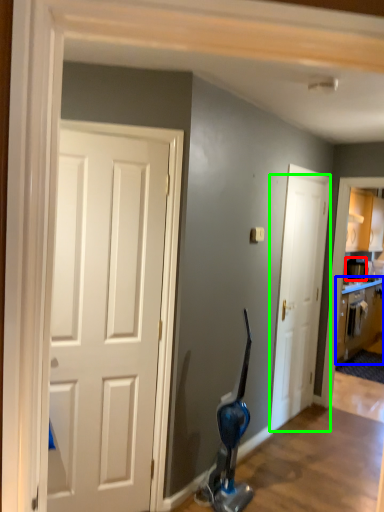
Question: Estimate the real-world distances between objects in this image. Which object is farther from appliance (highlighted by a red box), cabinetry (highlighted by a blue box) or door (highlighted by a green box)?

Choices:
 (A) cabinetry
 (B) door

Answer: (B)